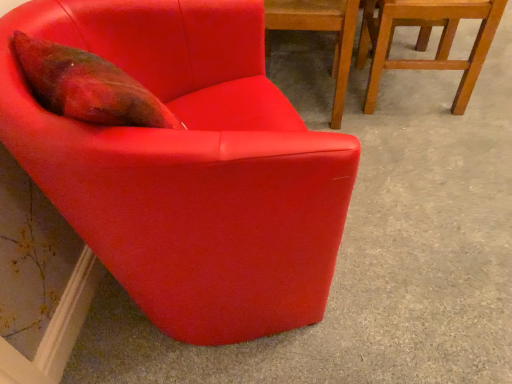
Question: Is matte red armchair at upper left, which is counted as the first chair, starting from the left, facing away from wooden chair at upper right, which appears as the 3th chair when viewed from the left?

Choices:
 (A) yes
 (B) no

Answer: (B)

Question: Is matte red armchair at upper left, which is counted as the first chair, starting from the left, directly adjacent to wooden chair at upper right, which appears as the 1th chair when viewed from the right?

Choices:
 (A) yes
 (B) no

Answer: (B)

Question: Is matte red armchair at upper left, arranged as the 3th chair when viewed from the right, bigger than wooden chair at upper right, which appears as the 1th chair when viewed from the right?

Choices:
 (A) yes
 (B) no

Answer: (A)

Question: From a real-world perspective, is matte red armchair at upper left, arranged as the 3th chair when viewed from the right, over wooden chair at upper right, which appears as the 3th chair when viewed from the left?

Choices:
 (A) no
 (B) yes

Answer: (B)

Question: Is matte red armchair at upper left, which is counted as the first chair, starting from the left, positioned before wooden chair at upper right, which appears as the 1th chair when viewed from the right?

Choices:
 (A) yes
 (B) no

Answer: (A)

Question: Would you say wooden chair at upper right, which appears as the 1th chair when viewed from the right, is inside or outside matte red armchair at upper left, arranged as the 3th chair when viewed from the right?

Choices:
 (A) outside
 (B) inside

Answer: (A)

Question: From a real-world perspective, is wooden chair at upper right, which appears as the 1th chair when viewed from the right, physically located above or below matte red armchair at upper left, arranged as the 3th chair when viewed from the right?

Choices:
 (A) above
 (B) below

Answer: (B)

Question: Is wooden chair at upper right, which appears as the 3th chair when viewed from the left, taller or shorter than matte red armchair at upper left, which is counted as the first chair, starting from the left?

Choices:
 (A) short
 (B) tall

Answer: (A)

Question: Considering their positions, is wooden chair at upper right, which appears as the 1th chair when viewed from the right, located in front of or behind matte red armchair at upper left, arranged as the 3th chair when viewed from the right?

Choices:
 (A) front
 (B) behind

Answer: (B)

Question: Relative to wooden chair at upper right, which appears as the 3th chair when viewed from the left, is matte red chair at center, the second chair positioned from the right, in front or behind?

Choices:
 (A) front
 (B) behind

Answer: (A)

Question: Considering the positions of point (332, 122) and point (364, 18), is point (332, 122) closer or farther from the camera than point (364, 18)?

Choices:
 (A) closer
 (B) farther

Answer: (A)

Question: Is matte red chair at center, the second chair positioned from the right, wider or thinner than wooden chair at upper right, which appears as the 3th chair when viewed from the left?

Choices:
 (A) wide
 (B) thin

Answer: (A)

Question: From the image's perspective, relative to wooden chair at upper right, which appears as the 1th chair when viewed from the right, is matte red chair at center, the second chair positioned from the right, above or below?

Choices:
 (A) above
 (B) below

Answer: (B)

Question: Considering the relative positions of wooden chair at upper right, which appears as the 3th chair when viewed from the left, and matte red chair at center, which ranks as the 2th chair in left-to-right order, in the image provided, is wooden chair at upper right, which appears as the 3th chair when viewed from the left, to the left or to the right of matte red chair at center, which ranks as the 2th chair in left-to-right order,?

Choices:
 (A) right
 (B) left

Answer: (A)

Question: In the image, is wooden chair at upper right, which appears as the 3th chair when viewed from the left, positioned in front of or behind matte red chair at center, the second chair positioned from the right?

Choices:
 (A) behind
 (B) front

Answer: (A)